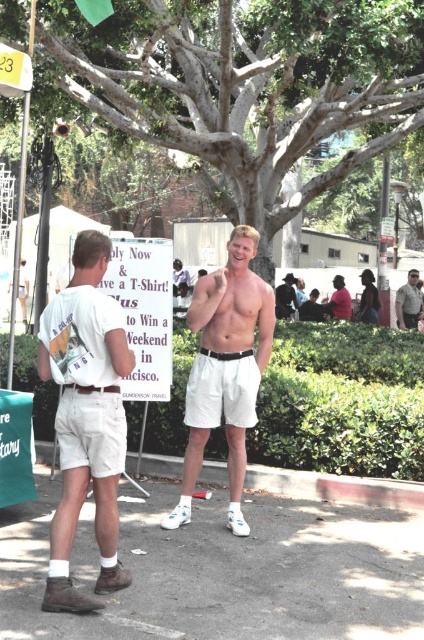
Is light brown leather jacket at upper right to the right of matte pink shirt at center from the viewer's perspective?

Correct, you'll find light brown leather jacket at upper right to the right of matte pink shirt at center.

Is light brown leather jacket at upper right thinner than matte pink shirt at center?

Incorrect, light brown leather jacket at upper right's width is not less than matte pink shirt at center's.

The width and height of the screenshot is (424, 640). Describe the element at coordinates (409, 301) in the screenshot. I see `light brown leather jacket at upper right` at that location.

Locate an element on the screen. Image resolution: width=424 pixels, height=640 pixels. light brown leather jacket at upper right is located at coordinates (409, 301).

Who is more distant from viewer, (122,448) or (198,440)?

Positioned behind is point (198,440).

Who is shorter, white cotton shorts at left or white cotton shorts at center?

white cotton shorts at left is shorter.

Between point (98, 604) and point (212, 352), which one is positioned behind?

Point (212, 352)

The image size is (424, 640). Find the location of `white cotton shorts at left`. white cotton shorts at left is located at coordinates (86, 417).

Who is positioned more to the left, white paper sign at center or light brown leather jacket at upper right?

white paper sign at center is more to the left.

Can you confirm if white paper sign at center is bigger than light brown leather jacket at upper right?

Correct, white paper sign at center is larger in size than light brown leather jacket at upper right.

Is point (114, 237) positioned before point (401, 289)?

Yes, it is in front of point (401, 289).

Find the location of a particular element. Image resolution: width=424 pixels, height=640 pixels. white paper sign at center is located at coordinates (144, 310).